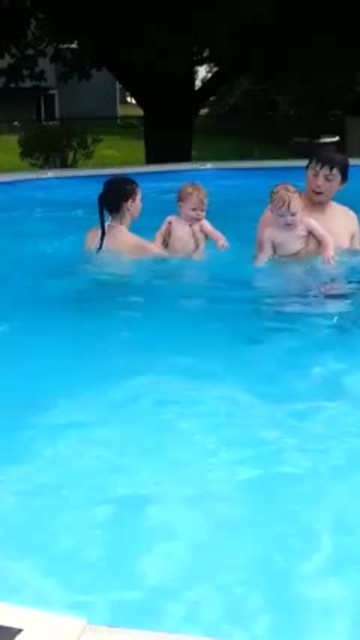
Who is shorter, smooth skin baby at upper right or blonde hair baby at center?

Standing shorter between the two is blonde hair baby at center.

Between point (317, 216) and point (313, 220), which one is positioned in front?

Positioned in front is point (313, 220).

The width and height of the screenshot is (360, 640). In order to click on smooth skin baby at upper right in this screenshot , I will do `click(330, 196)`.

Is blonde hair baby at center below smooth skin baby at center?

Correct, blonde hair baby at center is located below smooth skin baby at center.

Which of these two, blonde hair baby at center or smooth skin baby at center, stands taller?

smooth skin baby at center is taller.

The height and width of the screenshot is (640, 360). I want to click on blonde hair baby at center, so click(288, 227).

Which is in front, point (308, 250) or point (172, 221)?

Point (308, 250)

Where is `smooth skin baby at upper right`? The image size is (360, 640). smooth skin baby at upper right is located at coordinates (330, 196).